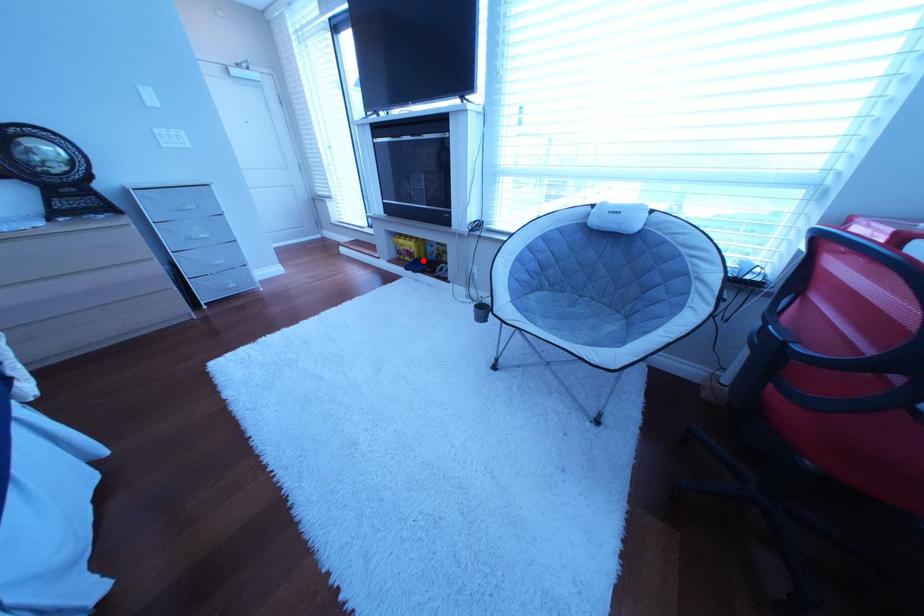
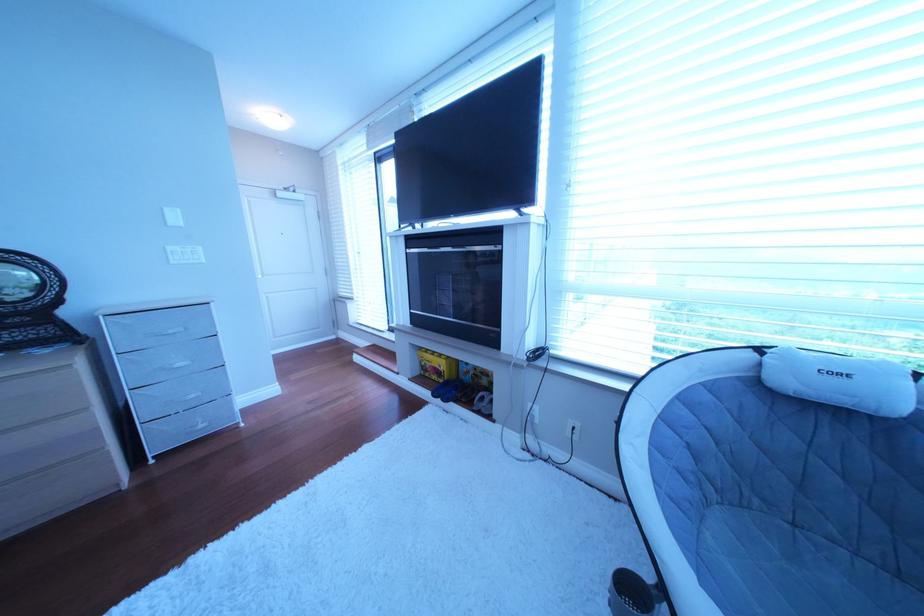
Question: I am providing you with two images of the same scene from different viewpoints. A red point is shown in image1. For the corresponding object point in image2, is it positioned nearer or farther from the camera?

Choices:
 (A) Nearer
 (B) Farther

Answer: (B)